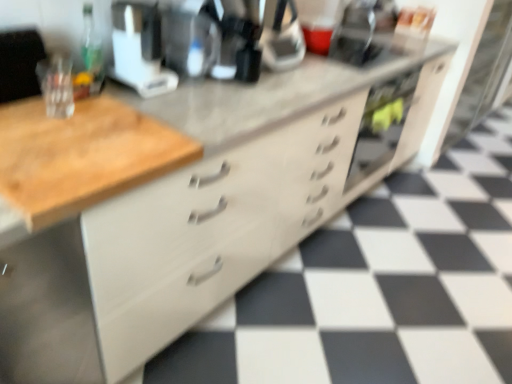
Question: Would you say green glass bottle at upper left is part of black plastic coffee machine at center's contents?

Choices:
 (A) yes
 (B) no

Answer: (B)

Question: Does black plastic coffee machine at center appear on the left side of green glass bottle at upper left?

Choices:
 (A) no
 (B) yes

Answer: (A)

Question: Does black plastic coffee machine at center come behind green glass bottle at upper left?

Choices:
 (A) no
 (B) yes

Answer: (B)

Question: Can you confirm if black plastic coffee machine at center is wider than green glass bottle at upper left?

Choices:
 (A) yes
 (B) no

Answer: (A)

Question: Can you confirm if black plastic coffee machine at center is positioned to the right of green glass bottle at upper left?

Choices:
 (A) no
 (B) yes

Answer: (B)

Question: From a real-world perspective, is black plastic coffee machine at center above or below green glass bottle at upper left?

Choices:
 (A) below
 (B) above

Answer: (B)

Question: From the image's perspective, is black plastic coffee machine at center above or below green glass bottle at upper left?

Choices:
 (A) below
 (B) above

Answer: (B)

Question: Looking at their shapes, would you say black plastic coffee machine at center is wider or thinner than green glass bottle at upper left?

Choices:
 (A) wide
 (B) thin

Answer: (A)

Question: In terms of height, does black plastic coffee machine at center look taller or shorter compared to green glass bottle at upper left?

Choices:
 (A) tall
 (B) short

Answer: (A)

Question: From the image's perspective, relative to white plastic coffee maker at upper center, is black plastic coffee machine at center above or below?

Choices:
 (A) below
 (B) above

Answer: (B)

Question: From their relative heights in the image, would you say black plastic coffee machine at center is taller or shorter than white plastic coffee maker at upper center?

Choices:
 (A) tall
 (B) short

Answer: (A)

Question: Is black plastic coffee machine at center in front of or behind white plastic coffee maker at upper center in the image?

Choices:
 (A) front
 (B) behind

Answer: (B)

Question: Does point (205, 52) appear closer or farther from the camera than point (173, 79)?

Choices:
 (A) farther
 (B) closer

Answer: (A)

Question: Considering the relative positions of white plastic coffee maker at upper center and green glass bottle at upper left in the image provided, is white plastic coffee maker at upper center to the left or to the right of green glass bottle at upper left?

Choices:
 (A) left
 (B) right

Answer: (B)

Question: Considering their positions, is white plastic coffee maker at upper center located in front of or behind green glass bottle at upper left?

Choices:
 (A) behind
 (B) front

Answer: (B)